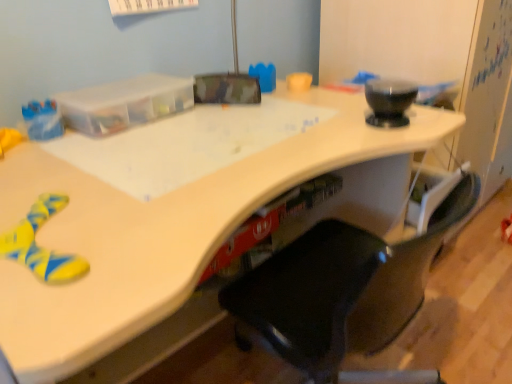
Question: From a real-world perspective, is black plastic chair at center above or below white glossy desk at lower left?

Choices:
 (A) below
 (B) above

Answer: (B)

Question: Looking at their shapes, would you say black plastic chair at center is wider or thinner than white glossy desk at lower left?

Choices:
 (A) wide
 (B) thin

Answer: (B)

Question: Based on their relative distances, which object is nearer to the rubberized red toy at lower right?

Choices:
 (A) black plastic chair at center
 (B) white glossy desk at lower left

Answer: (A)

Question: Estimate the real-world distances between objects in this image. Which object is farther from the rubberized red toy at lower right?

Choices:
 (A) black plastic chair at center
 (B) white glossy desk at lower left

Answer: (B)